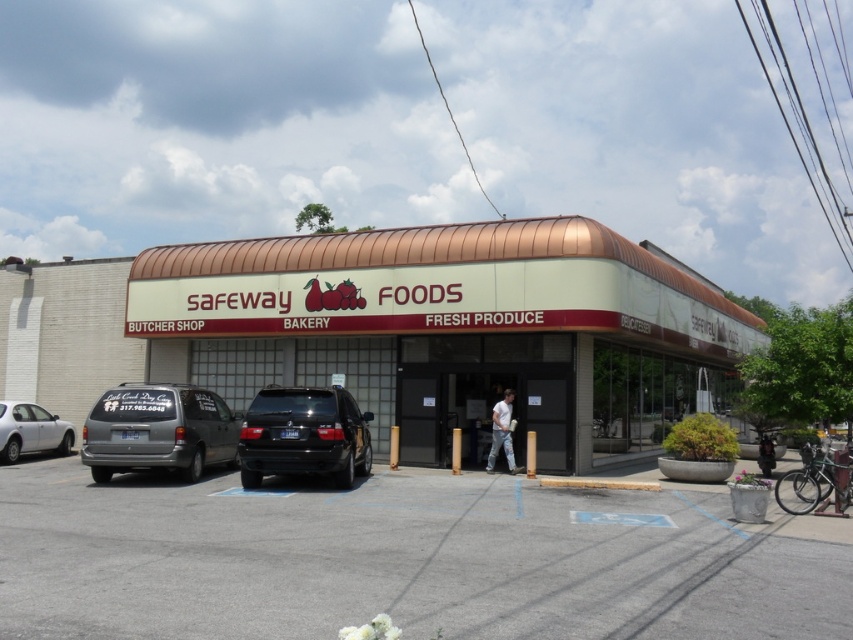
Question: Does gray asphalt parking lot at center appear on the right side of silver metallic van at left?

Choices:
 (A) yes
 (B) no

Answer: (A)

Question: Is gray asphalt parking lot at center wider than silver metallic van at left?

Choices:
 (A) no
 (B) yes

Answer: (B)

Question: Which point is closer to the camera?

Choices:
 (A) silver metallic van at left
 (B) silver metallic sedan at left

Answer: (A)

Question: Where is white matte building at center located in relation to black matte suv at center in the image?

Choices:
 (A) left
 (B) right

Answer: (B)

Question: Which point is closer to the camera?

Choices:
 (A) silver metallic van at left
 (B) black matte suv at center
 (C) white matte building at center
 (D) silver metallic sedan at left

Answer: (B)

Question: Which point is farther to the camera?

Choices:
 (A) silver metallic sedan at left
 (B) white matte building at center

Answer: (A)